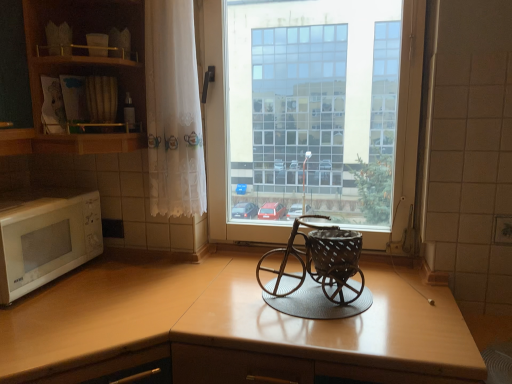
Image resolution: width=512 pixels, height=384 pixels. What are the coordinates of `free point to the left of rustic metal bicycle at center` in the screenshot? It's located at (234, 295).